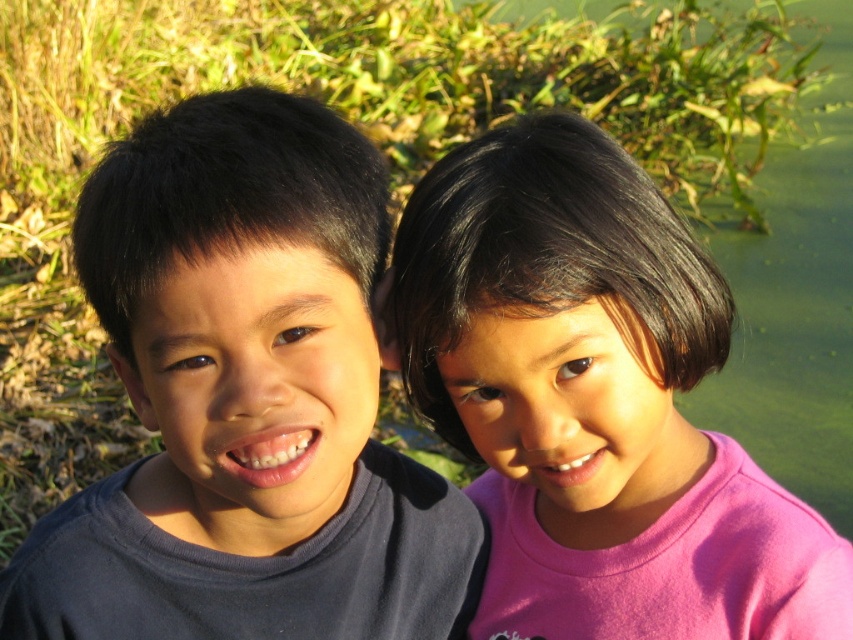
Can you confirm if matte dark blue shirt at left is taller than pink matte shirt at right?

In fact, matte dark blue shirt at left may be shorter than pink matte shirt at right.

Based on the photo, does matte dark blue shirt at left appear on the left side of pink matte shirt at right?

Yes, matte dark blue shirt at left is to the left of pink matte shirt at right.

Between point (183, 608) and point (445, 353), which one is positioned in front?

Positioned in front is point (445, 353).

At what (x,y) coordinates should I click in order to perform the action: click on matte dark blue shirt at left. Please return your answer as a coordinate pair (x, y). This screenshot has width=853, height=640. Looking at the image, I should click on (245, 401).